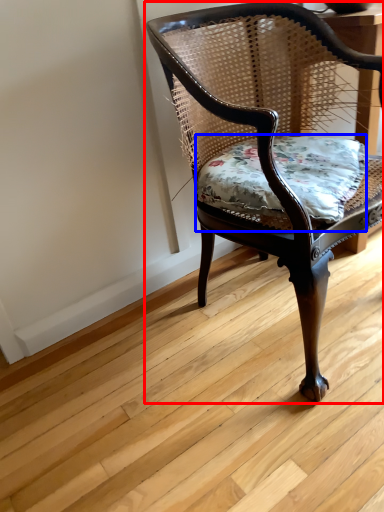
Question: Which object appears closest to the camera in this image, chair (highlighted by a red box) or pillow (highlighted by a blue box)?

Choices:
 (A) chair
 (B) pillow

Answer: (A)